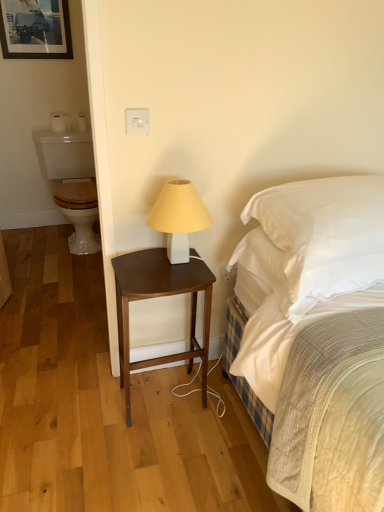
Question: From a real-world perspective, is white glossy toilet at left located beneath white satin pillow at upper right?

Choices:
 (A) no
 (B) yes

Answer: (B)

Question: Is white glossy toilet at left in front of white satin pillow at upper right?

Choices:
 (A) yes
 (B) no

Answer: (B)

Question: Is white glossy toilet at left oriented away from white satin pillow at upper right?

Choices:
 (A) yes
 (B) no

Answer: (B)

Question: Is white glossy toilet at left wider than white satin pillow at upper right?

Choices:
 (A) no
 (B) yes

Answer: (B)

Question: Is white glossy toilet at left touching white satin pillow at upper right?

Choices:
 (A) yes
 (B) no

Answer: (B)

Question: Is matte black picture frame at upper left situated inside dark wood nightstand at center or outside?

Choices:
 (A) inside
 (B) outside

Answer: (B)

Question: Is matte black picture frame at upper left wider or thinner than dark wood nightstand at center?

Choices:
 (A) thin
 (B) wide

Answer: (A)

Question: In terms of height, does matte black picture frame at upper left look taller or shorter compared to dark wood nightstand at center?

Choices:
 (A) short
 (B) tall

Answer: (A)

Question: From a real-world perspective, is matte black picture frame at upper left physically located above or below dark wood nightstand at center?

Choices:
 (A) above
 (B) below

Answer: (A)

Question: Is white matte table lamp at center to the left or to the right of matte black picture frame at upper left in the image?

Choices:
 (A) right
 (B) left

Answer: (A)

Question: Is white matte table lamp at center inside the boundaries of matte black picture frame at upper left, or outside?

Choices:
 (A) outside
 (B) inside

Answer: (A)

Question: From a real-world perspective, is white matte table lamp at center above or below matte black picture frame at upper left?

Choices:
 (A) above
 (B) below

Answer: (B)

Question: Is white matte table lamp at center in front of or behind matte black picture frame at upper left in the image?

Choices:
 (A) front
 (B) behind

Answer: (A)

Question: Is white matte table lamp at center in front of or behind white satin pillow at upper right in the image?

Choices:
 (A) front
 (B) behind

Answer: (B)

Question: Considering the relative positions of white matte table lamp at center and white satin pillow at upper right in the image provided, is white matte table lamp at center to the left or to the right of white satin pillow at upper right?

Choices:
 (A) right
 (B) left

Answer: (B)